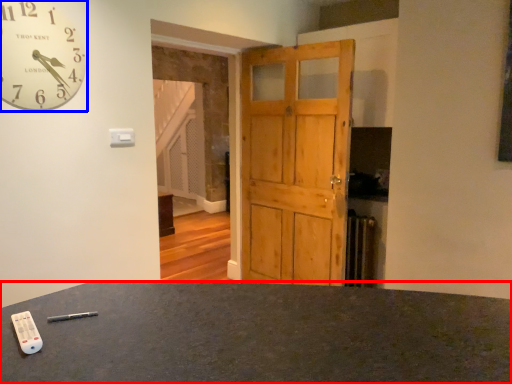
Question: Which point is further to the camera, desk (highlighted by a red box) or wall clock (highlighted by a blue box)?

Choices:
 (A) desk
 (B) wall clock

Answer: (B)